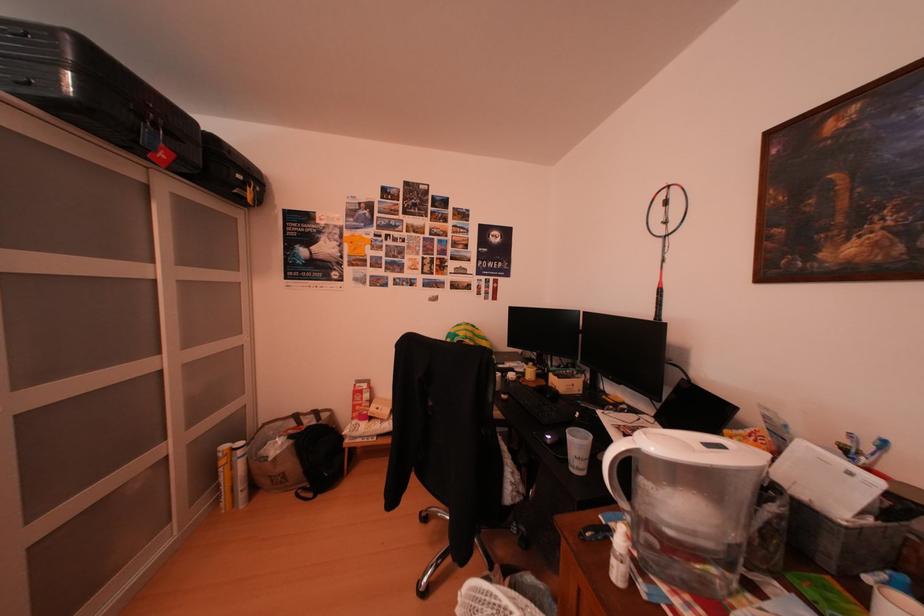
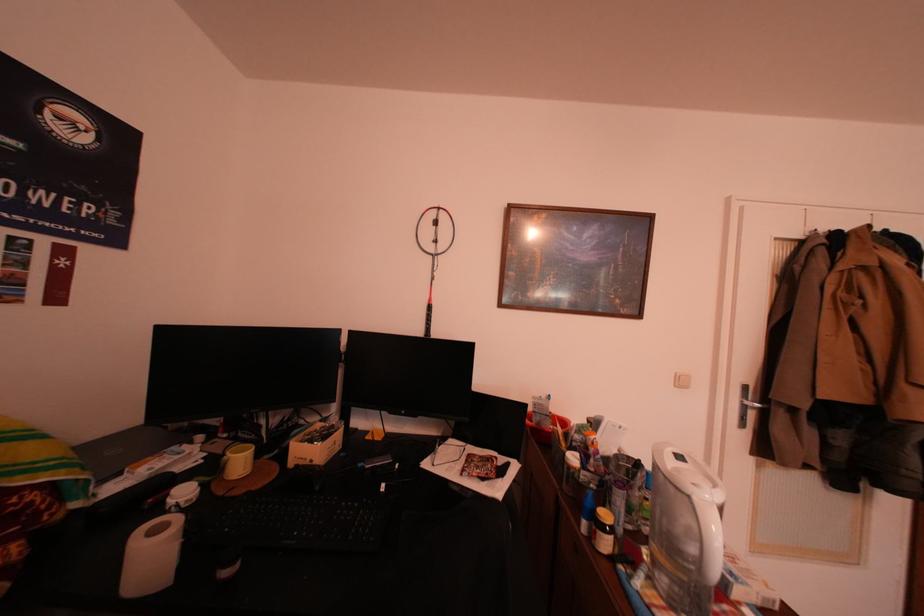
Question: How did the camera likely rotate?

Choices:
 (A) Left
 (B) Right
 (C) Up
 (D) Down

Answer: (B)